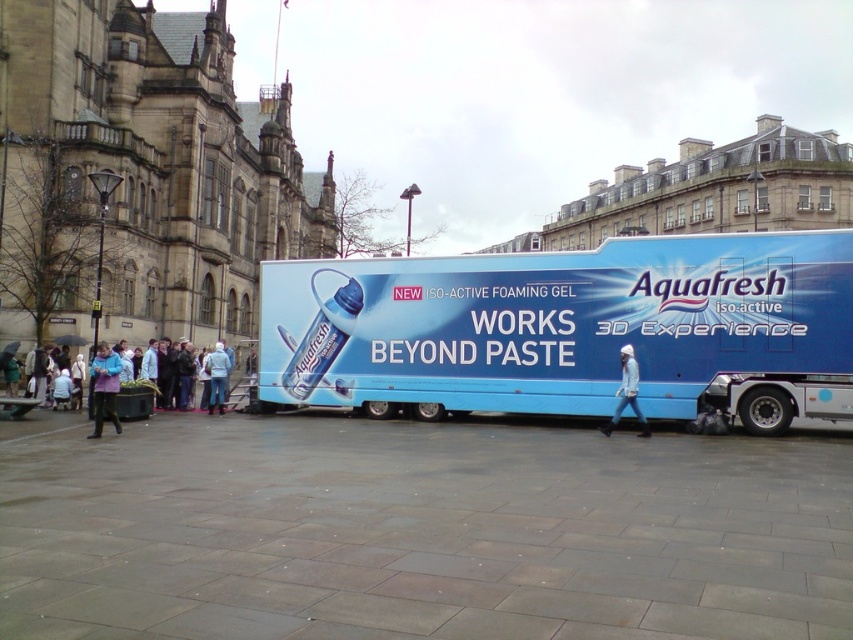
Question: Among these objects, which one is farthest from the camera?

Choices:
 (A) blue glossy bus at center
 (B) blue fleece jacket at lower left
 (C) white knit hat at center
 (D) light purple jacket at lower left

Answer: (C)

Question: Does blue glossy bus at center have a greater width compared to light purple jacket at lower left?

Choices:
 (A) yes
 (B) no

Answer: (A)

Question: Which of the following is the farthest from the observer?

Choices:
 (A) (102, 403)
 (B) (403, 388)

Answer: (B)

Question: Is blue fleece jacket at lower left above white knit hat at center?

Choices:
 (A) yes
 (B) no

Answer: (B)

Question: Which object appears closest to the camera in this image?

Choices:
 (A) blue glossy bus at center
 (B) blue fleece jacket at lower left

Answer: (A)

Question: Can you confirm if blue glossy bus at center is thinner than light purple jacket at lower left?

Choices:
 (A) yes
 (B) no

Answer: (B)